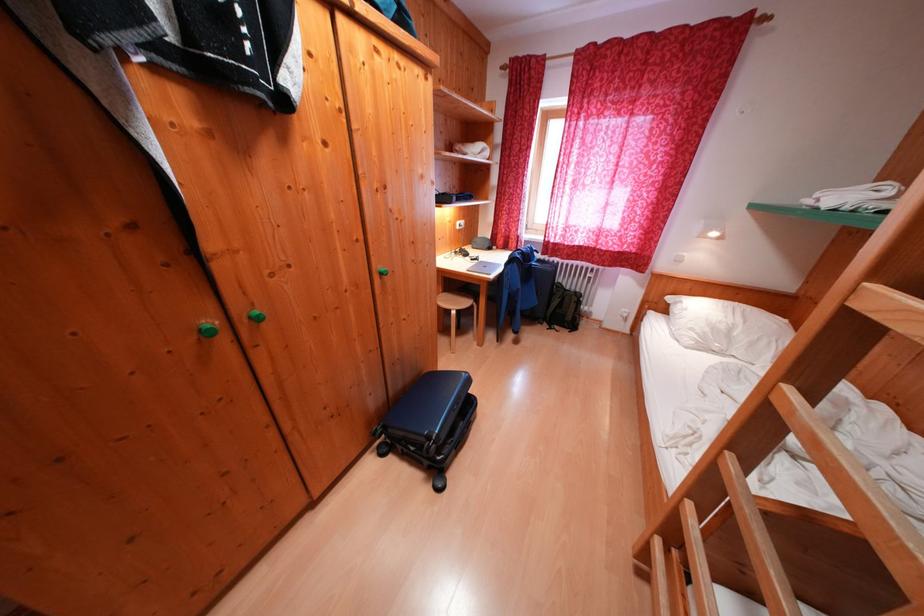
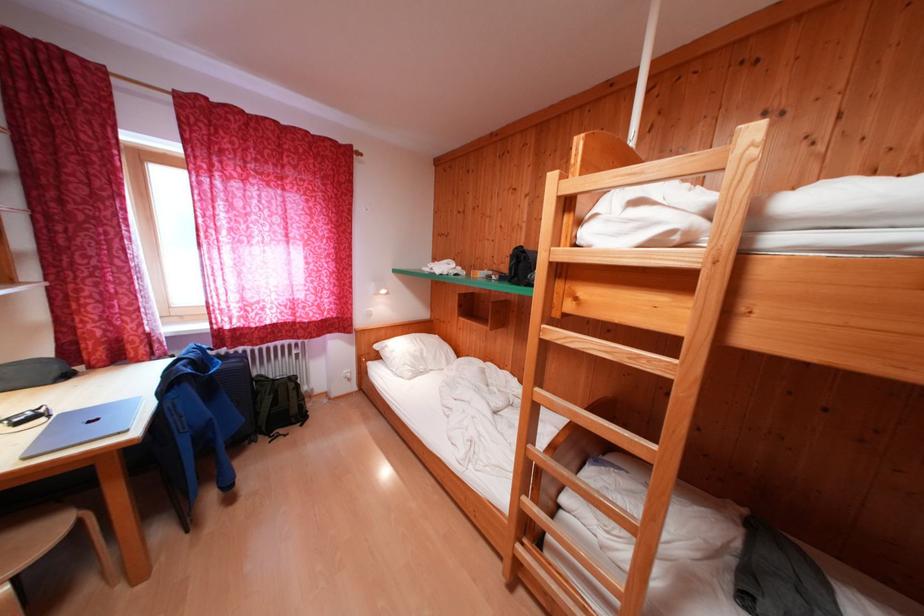
Question: The camera is either moving clockwise (left) or counter-clockwise (right) around the object. The first image is from the beginning of the video and the second image is from the end. Is the camera moving left or right when shooting the video?

Choices:
 (A) Left
 (B) Right

Answer: (A)